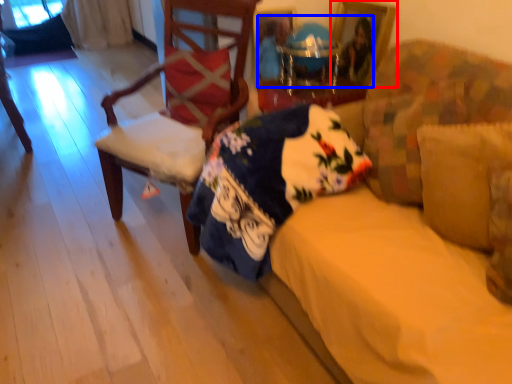
Question: Which object appears closest to the camera in this image, picture frame (highlighted by a red box) or couple (highlighted by a blue box)?

Choices:
 (A) picture frame
 (B) couple

Answer: (B)